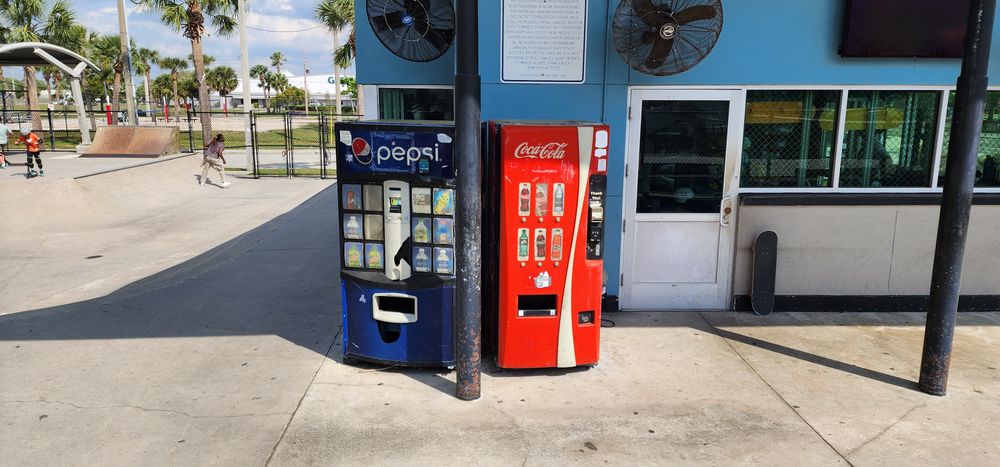
Identify the location of door knob. (730, 207).